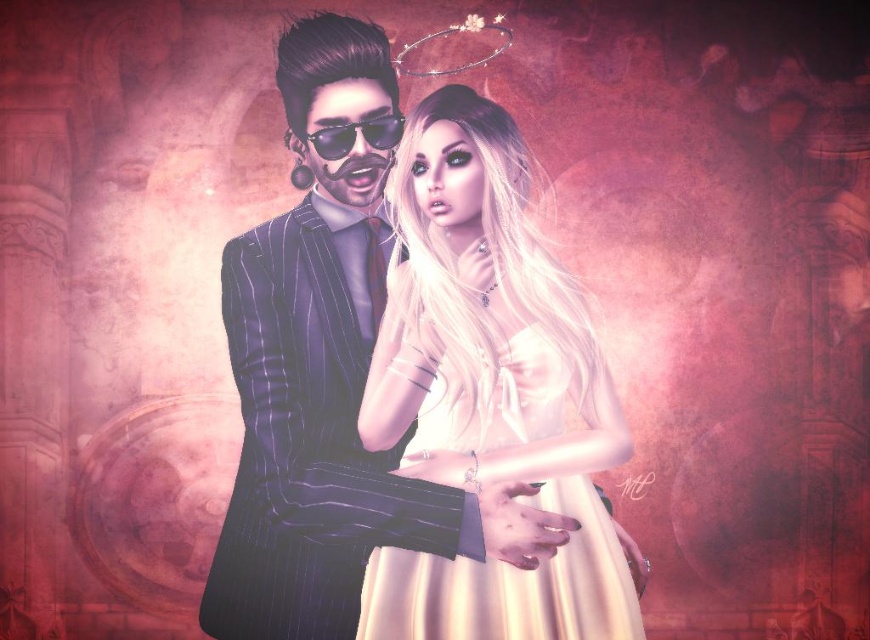
Is shiny black suit at center below black reflective sunglasses at upper center?

Yes.

Between point (522, 556) and point (336, 124), which one is positioned behind?

The point (336, 124) is more distant.

The width and height of the screenshot is (870, 640). Find the location of `shiny black suit at center`. shiny black suit at center is located at coordinates (329, 378).

Between shiny black suit at center and dark pinstripe suit at center, which one is positioned higher?

shiny black suit at center is higher up.

Between shiny black suit at center and dark pinstripe suit at center, which one appears on the left side from the viewer's perspective?

Positioned to the left is dark pinstripe suit at center.

Is point (271, 400) farther from camera compared to point (263, 250)?

No, (271, 400) is in front of (263, 250).

Where is `shiny black suit at center`? The image size is (870, 640). shiny black suit at center is located at coordinates (329, 378).

Between satin cream dress at center and black reflective sunglasses at upper center, which one appears on the left side from the viewer's perspective?

black reflective sunglasses at upper center

Is satin cream dress at center to the left of black reflective sunglasses at upper center from the viewer's perspective?

Incorrect, satin cream dress at center is not on the left side of black reflective sunglasses at upper center.

Is point (574, 576) farther from camera compared to point (310, 134)?

That is False.

You are a GUI agent. You are given a task and a screenshot of the screen. Output one action in this format:
    pyautogui.click(x=<x>, y=<y>)
    Task: Click on the satin cream dress at center
    
    Given the screenshot: What is the action you would take?
    pyautogui.click(x=520, y=500)